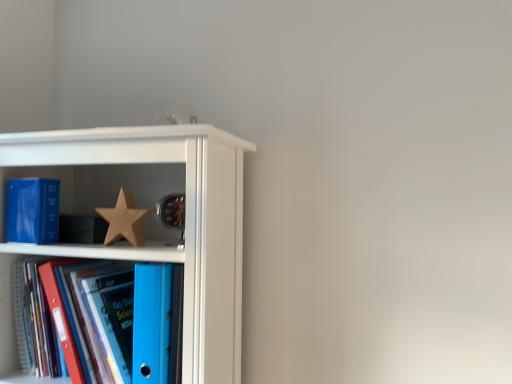
Question: Visually, is matte blue paperback book at left positioned to the left or to the right of wooden star at center?

Choices:
 (A) left
 (B) right

Answer: (A)

Question: From a real-world perspective, is matte blue paperback book at left physically located above or below wooden star at center?

Choices:
 (A) below
 (B) above

Answer: (B)

Question: Estimate the real-world distances between objects in this image. Which object is closer to the matte blue paperback book at left?

Choices:
 (A) wooden star at center
 (B) blue plastic folder at lower left
 (C) white glossy bookshelf at upper left

Answer: (A)

Question: Considering the real-world distances, which object is farthest from the white glossy bookshelf at upper left?

Choices:
 (A) blue plastic folder at lower left
 (B) wooden star at center
 (C) matte blue paperback book at left

Answer: (C)